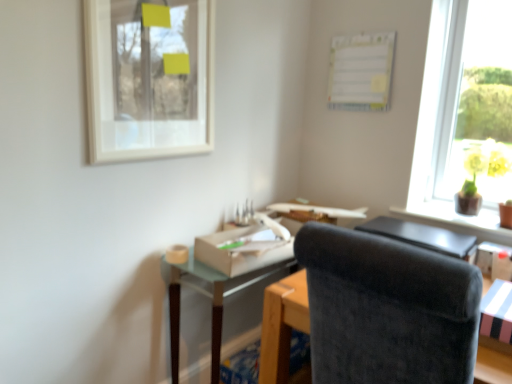
Question: Can you confirm if yellow glossy vase at upper right is smaller than white paperboard at upper center?

Choices:
 (A) no
 (B) yes

Answer: (A)

Question: Is yellow glossy vase at upper right outside of white paperboard at upper center?

Choices:
 (A) no
 (B) yes

Answer: (B)

Question: Is yellow glossy vase at upper right in contact with white paperboard at upper center?

Choices:
 (A) no
 (B) yes

Answer: (A)

Question: Considering the relative sizes of yellow glossy vase at upper right and white paperboard at upper center in the image provided, is yellow glossy vase at upper right shorter than white paperboard at upper center?

Choices:
 (A) no
 (B) yes

Answer: (B)

Question: Considering the relative positions of yellow glossy vase at upper right and white paperboard at upper center in the image provided, is yellow glossy vase at upper right to the right of white paperboard at upper center from the viewer's perspective?

Choices:
 (A) no
 (B) yes

Answer: (B)

Question: In terms of width, does white cardboard box at lower right, which is the first cardboard box in front-to-back order, look wider or thinner when compared to velvet black chair at center?

Choices:
 (A) thin
 (B) wide

Answer: (A)

Question: From a real-world perspective, relative to velvet black chair at center, is white cardboard box at lower right, the 2th cardboard box when ordered from back to front, vertically above or below?

Choices:
 (A) below
 (B) above

Answer: (B)

Question: Is white cardboard box at lower right, arranged as the 2th cardboard box when viewed from the left, in front of or behind velvet black chair at center in the image?

Choices:
 (A) behind
 (B) front

Answer: (A)

Question: Looking at the image, does white cardboard box at lower right, placed as the 2th cardboard box when sorted from top to bottom, seem bigger or smaller compared to velvet black chair at center?

Choices:
 (A) small
 (B) big

Answer: (A)

Question: Is white matte picture frame at upper left taller or shorter than yellow glossy vase at upper right?

Choices:
 (A) short
 (B) tall

Answer: (B)

Question: Considering the positions of white matte picture frame at upper left and yellow glossy vase at upper right in the image, is white matte picture frame at upper left wider or thinner than yellow glossy vase at upper right?

Choices:
 (A) thin
 (B) wide

Answer: (A)

Question: Would you say white matte picture frame at upper left is to the left or to the right of yellow glossy vase at upper right in the picture?

Choices:
 (A) right
 (B) left

Answer: (B)

Question: Based on their sizes in the image, would you say white matte picture frame at upper left is bigger or smaller than yellow glossy vase at upper right?

Choices:
 (A) small
 (B) big

Answer: (B)

Question: Considering the positions of point (330, 57) and point (480, 175), is point (330, 57) closer or farther from the camera than point (480, 175)?

Choices:
 (A) farther
 (B) closer

Answer: (A)

Question: From the image's perspective, is white paperboard at upper center located above or below yellow glossy vase at upper right?

Choices:
 (A) below
 (B) above

Answer: (B)